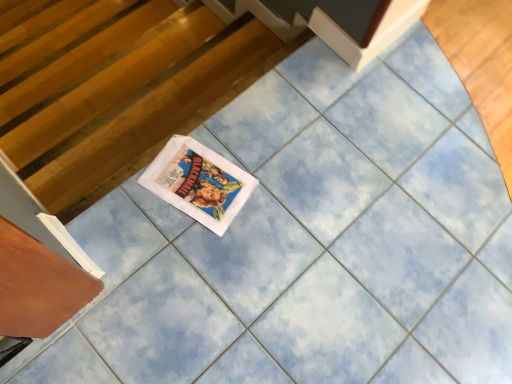
The image size is (512, 384). Find the location of `free point behind wooden drawer at lower left`. free point behind wooden drawer at lower left is located at coordinates (116, 249).